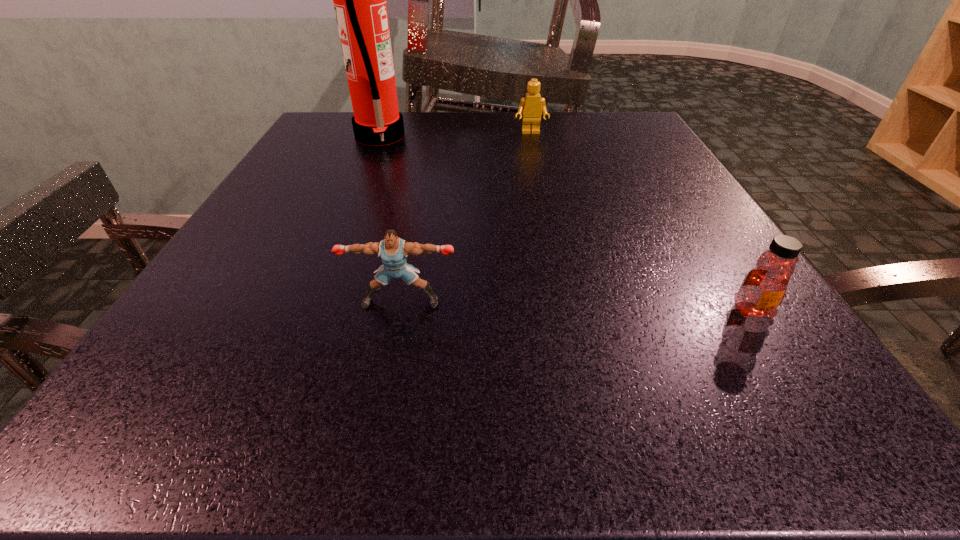
You are a GUI agent. You are given a task and a screenshot of the screen. Output one action in this format:
    pyautogui.click(x=<x>, y=<y>)
    Task: Click on the object that is positioned at the left edge
    
    Given the screenshot: What is the action you would take?
    coord(359,0)

The width and height of the screenshot is (960, 540). I want to click on object that is at the right edge, so click(x=763, y=289).

This screenshot has width=960, height=540. Find the location of `object located at the far left corner`. object located at the far left corner is located at coordinates (359, 0).

The width and height of the screenshot is (960, 540). In order to click on free point at the far edge in this screenshot , I will do `click(428, 136)`.

The width and height of the screenshot is (960, 540). Identify the location of vacant space at the near edge. (620, 366).

Where is `vacant space at the left edge of the desktop`? vacant space at the left edge of the desktop is located at coordinates pyautogui.click(x=239, y=228).

I want to click on vacant area at the right edge of the desktop, so click(x=668, y=165).

Where is `blank space at the near left corner of the desktop`? The height and width of the screenshot is (540, 960). blank space at the near left corner of the desktop is located at coordinates click(221, 386).

In the image, there is a desktop. Where is `free space at the far right corner`? free space at the far right corner is located at coordinates (592, 114).

Find the location of a particular element. free spot at the near right corner of the desktop is located at coordinates (826, 374).